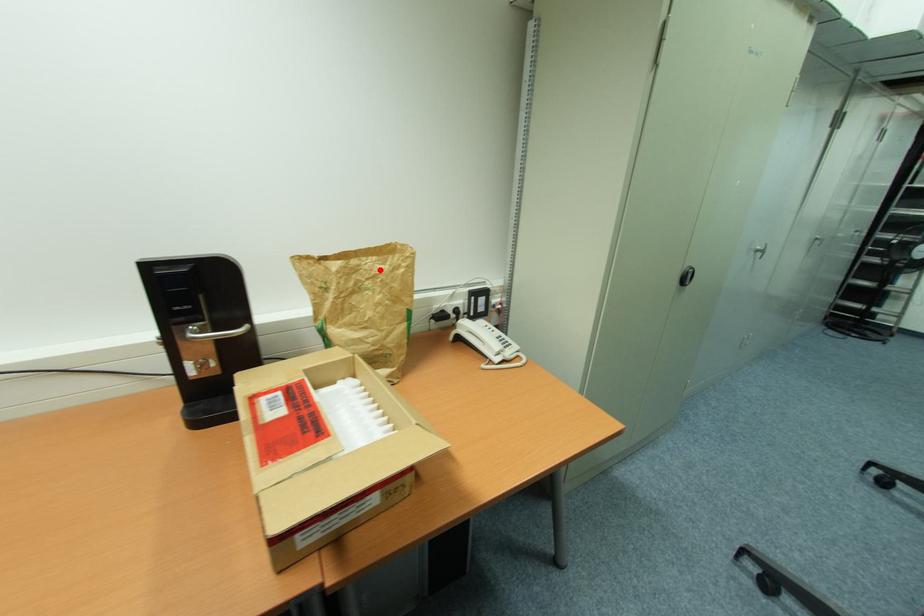
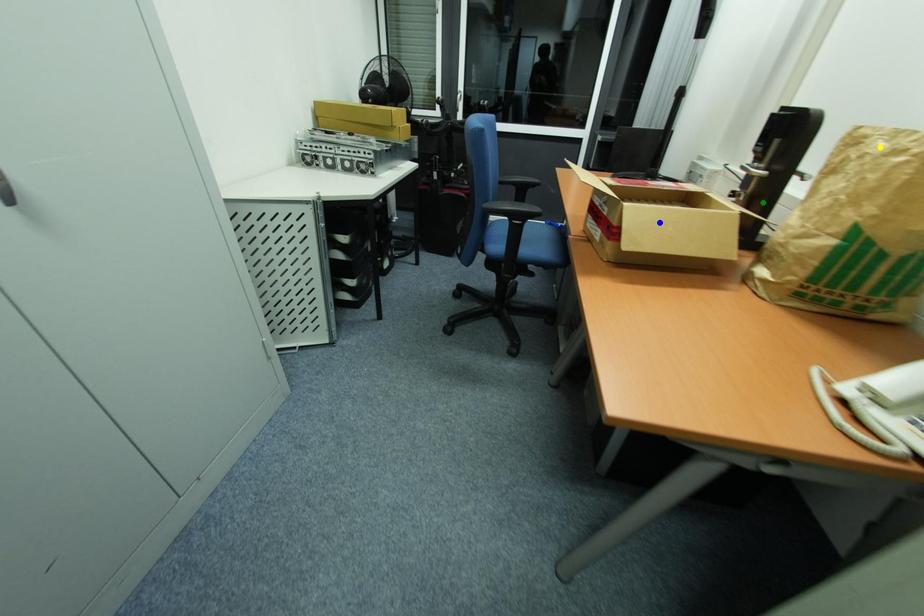
Question: I am providing you with two images of the same scene from different viewpoints. A red point is marked on the first image. You are given multiple points on the second image. Can you choose the point in image 2 that corresponds to the point in image 1?

Choices:
 (A) yellow point
 (B) blue point
 (C) green point

Answer: (A)